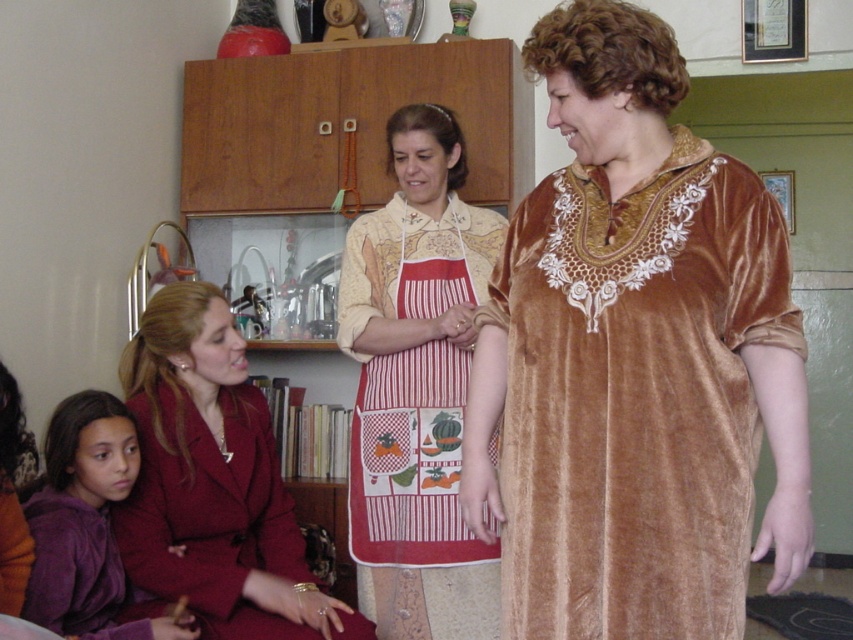
Looking at this image, in the kitchen scene described, there are two pieces of clothing depicted. The first is a velvet gold dress at center, and the second is a purple velvet sweater at lower left. Considering their sizes, which clothing item would require more fabric to create?

The velvet gold dress at center requires more fabric because it is larger in size than the purple velvet sweater at lower left.

In the kitchen scene described, there are two central items of clothing worn by the individuals. The first is a velvet gold dress at center, and the second is a striped apron at center. Based on their positions, which one is located to the right of the other?

The velvet gold dress at center is positioned to the right of the striped apron at center.

You are standing at the point labeled point (654, 148) in the kitchen. If you want to take a photo of the entire kitchen scene, would the camera positioned at your current location capture the whole view? Explain your reasoning based on the distance between the camera and the point.

The camera positioned at point (654, 148) is 1.65 meters away from the camera. However, since the camera is at the same location as the point, the distance should be zero. There might be an error in the provided information. To capture the entire kitchen scene, you might need to adjust your position or use a wider lens.